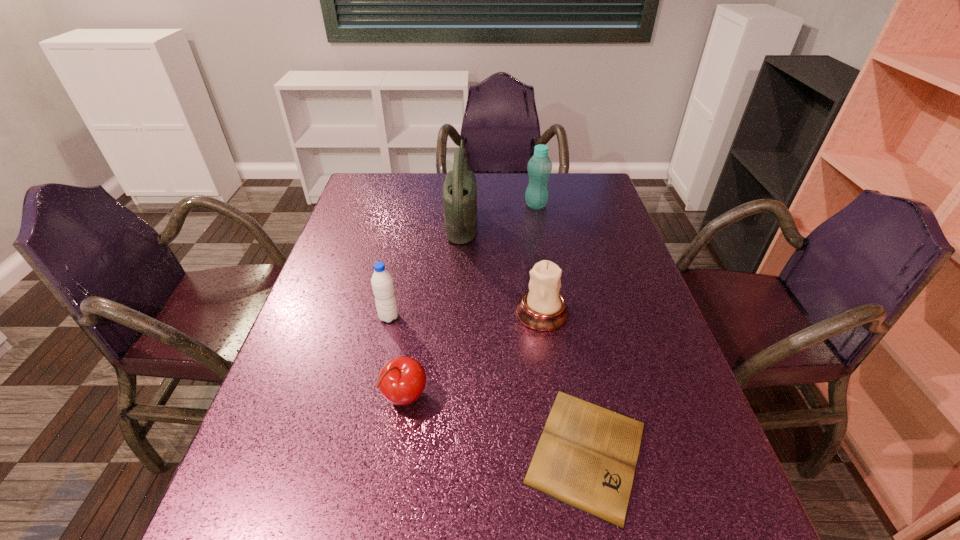
You are a GUI agent. You are given a task and a screenshot of the screen. Output one action in this format:
    pyautogui.click(x=<x>, y=<y>)
    Task: Click on the watering can
    The image size is (960, 540).
    Given the screenshot: What is the action you would take?
    pyautogui.click(x=460, y=186)

This screenshot has height=540, width=960. I want to click on the right water bottle, so click(x=539, y=167).

The image size is (960, 540). In order to click on the taller water bottle in this screenshot , I will do `click(539, 167)`.

Where is `the nearer water bottle`? This screenshot has width=960, height=540. the nearer water bottle is located at coordinates (382, 283).

Identify the location of the left water bottle. This screenshot has height=540, width=960. (382, 283).

This screenshot has width=960, height=540. I want to click on candle holder, so click(x=542, y=307).

The image size is (960, 540). What are the coordinates of `cherry` in the screenshot? It's located at (401, 381).

The width and height of the screenshot is (960, 540). I want to click on book, so click(x=586, y=457).

Where is `free location located 0.050m on the spout of the watering can`? Image resolution: width=960 pixels, height=540 pixels. free location located 0.050m on the spout of the watering can is located at coordinates (493, 219).

What are the coordinates of `free region located at the front cap of the taller water bottle` in the screenshot? It's located at (541, 235).